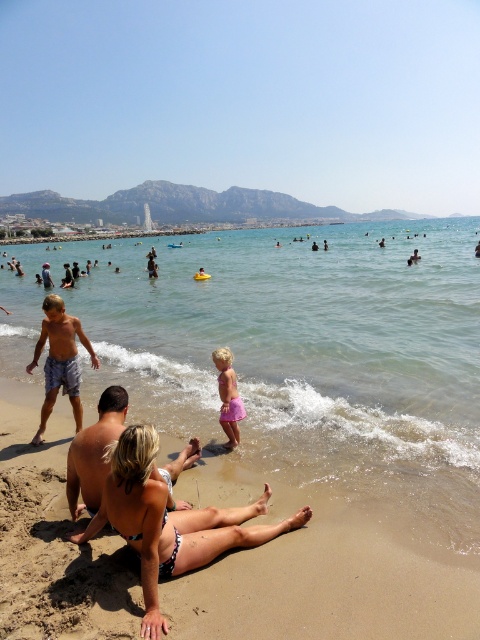
You are standing at the point labeled point (231, 381) and want to walk to the point labeled point (135, 508). Will you be moving towards the beach or away from it?

Since point (135, 508) is in front of point (231, 381), you will be moving towards the beach.

You are standing at the beach and want to take a photo that includes both the point at coordinates point (98,324) and point (223,378). Based on their positions, which point is closer to you when you are facing the beach scene?

Point (98,324) is closer to you than point (223,378) because it is further to the camera, meaning it is positioned nearer in the scene.